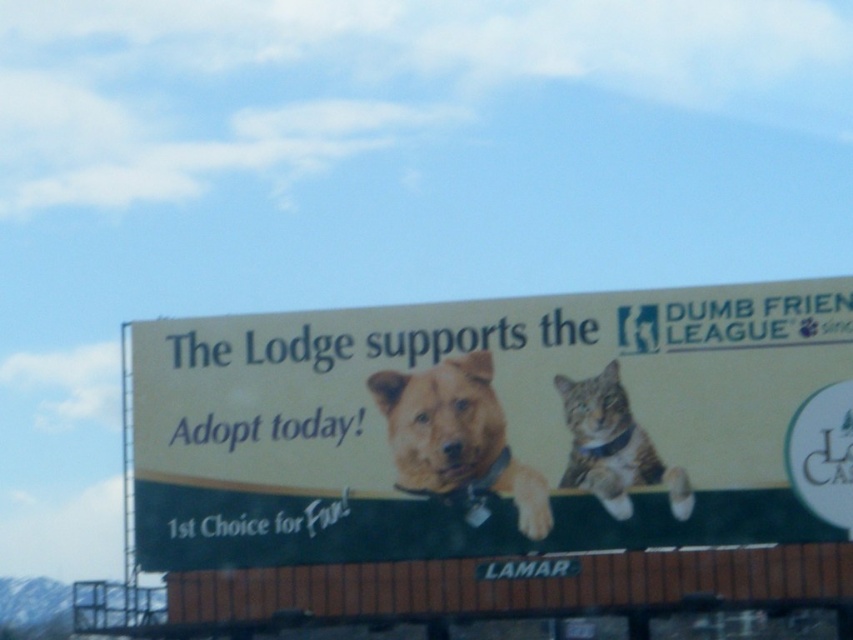
In the scene shown: You are a graphic designer reviewing the billboard layout. You need to ensure that the brown fur dog at center is not taller than the white paper billboard at center. Does the current design meet this requirement?

The white paper billboard at center is taller than brown fur dog at center, so the current design meets the requirement.

Looking at the billboard advertisement, there are two animals in the center. The brown fur dog at center and the tabby fur cat at center. Which animal appears thinner?

The brown fur dog at center is thinner than the tabby fur cat at center.